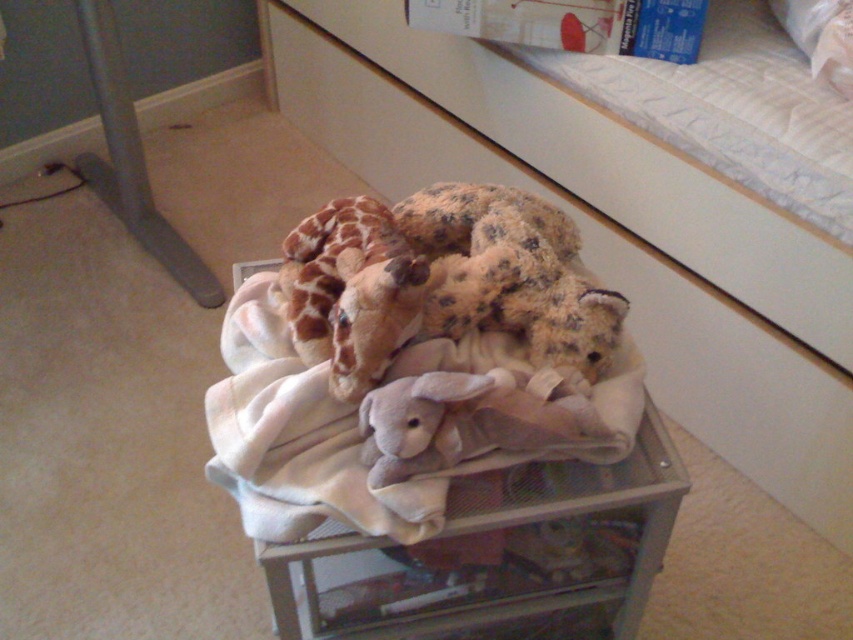
You have a fluffy brown teddy bear at center that you want to place inside the gray mesh crate at center. Based on their sizes, will the teddy bear fit inside the crate?

The gray mesh crate at center is wider than the fluffy brown teddy bear at center, so the teddy bear should fit inside the crate.

You are trying to decide whether to place a new decorative item on the beige fabric dresser at center or on the fluffy brown teddy bear at center. Which surface would be more stable for placing the item?

The beige fabric dresser at center is wider than the fluffy brown teddy bear at center, so it would provide a more stable surface for placing the item.

You are looking at the storage container and notice two points marked on it. One is at coordinate point (242, 508) and the other is at point (447, 308). Which of these two points is nearer to your viewpoint?

Point (242, 508) is closer to the camera than point (447, 308), so the point at coordinate point (242, 508) is nearer to your viewpoint.